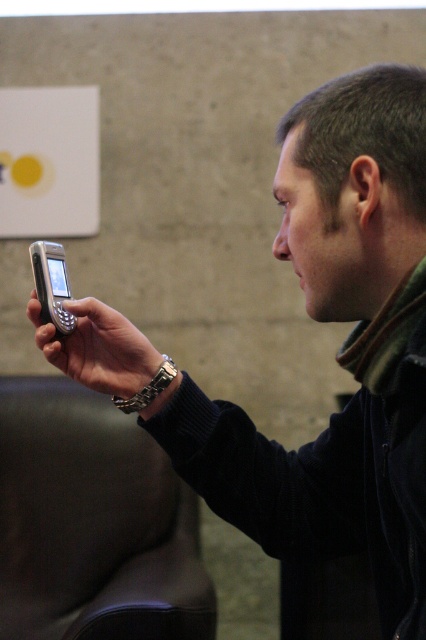
You are a customer in a store looking at two phones displayed on a shelf. The silver metallic phone at center and the matte black phone at center are both on the shelf. Which phone is placed higher on the shelf?

The matte black phone at center is placed higher on the shelf because the silver metallic phone at center is located below it.